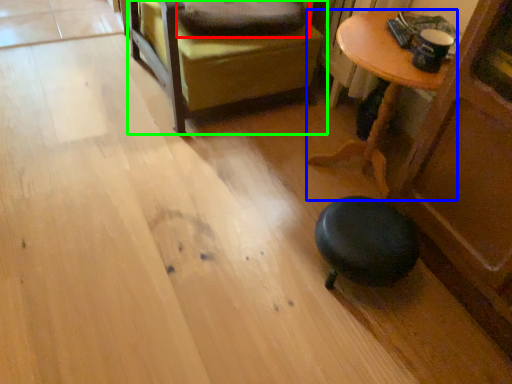
Question: Considering the real-world distances, which object is closest to pillow (highlighted by a red box)? table (highlighted by a blue box) or furniture (highlighted by a green box).

Choices:
 (A) table
 (B) furniture

Answer: (B)